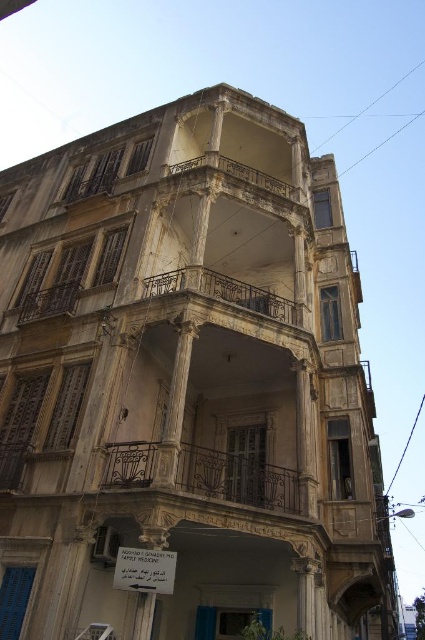
Question: Which point is farther to the camera?

Choices:
 (A) (254, 308)
 (B) (271, 470)

Answer: (A)

Question: Which object is farther from the camera taking this photo?

Choices:
 (A) rusty metal balcony at center
 (B) rustic wrought iron balcony at center

Answer: (A)

Question: Observing the image, what is the correct spatial positioning of rustic wrought iron balcony at center in reference to rusty metal balcony at center?

Choices:
 (A) left
 (B) right

Answer: (A)

Question: Does rustic wrought iron balcony at center appear on the right side of rusty metal balcony at center?

Choices:
 (A) no
 (B) yes

Answer: (A)

Question: Does rustic wrought iron balcony at center have a greater width compared to rusty metal balcony at center?

Choices:
 (A) yes
 (B) no

Answer: (A)